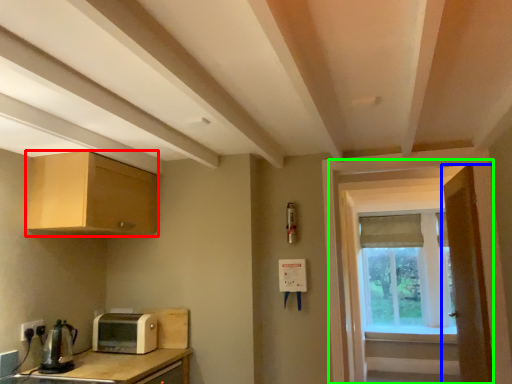
Question: Based on their relative distances, which object is nearer to cabinetry (highlighted by a red box)? Choose from door (highlighted by a blue box) and screen door (highlighted by a green box).

Choices:
 (A) door
 (B) screen door

Answer: (B)